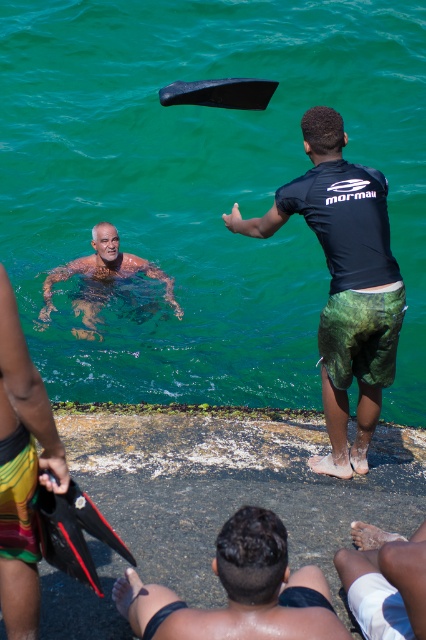
Between multicolored fabric shorts at lower left and smooth skin man at center, which one appears on the left side from the viewer's perspective?

smooth skin man at center is more to the left.

Which is more to the right, multicolored fabric shorts at lower left or smooth skin man at center?

From the viewer's perspective, multicolored fabric shorts at lower left appears more on the right side.

Which is in front, point (20, 332) or point (92, 282)?

Point (20, 332)

Find the location of `multicolored fabric shorts at lower left`. multicolored fabric shorts at lower left is located at coordinates (22, 468).

Does dark brown skin at lower center appear under smooth skin man at center?

Yes, dark brown skin at lower center is below smooth skin man at center.

Is point (287, 588) positioned behind point (175, 310)?

No, (287, 588) is closer to viewer.

Find the location of a particular element. The image size is (426, 640). dark brown skin at lower center is located at coordinates 236,592.

Does point (259, 595) come in front of point (54, 442)?

Yes, it is.

The image size is (426, 640). Find the location of `dark brown skin at lower center`. dark brown skin at lower center is located at coordinates (236, 592).

You are a GUI agent. You are given a task and a screenshot of the screen. Output one action in this format:
    pyautogui.click(x=<x>, y=<y>)
    Task: Click on the dark brown skin at lower center
    The height and width of the screenshot is (640, 426).
    Given the screenshot: What is the action you would take?
    pyautogui.click(x=236, y=592)